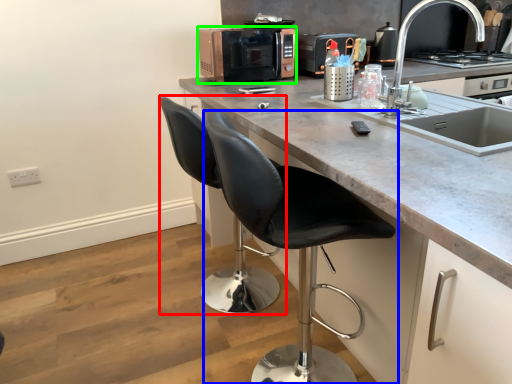
Question: Which object is positioned closest to swivel chair (highlighted by a red box)? Select from chair (highlighted by a blue box) and microwave oven (highlighted by a green box).

Choices:
 (A) chair
 (B) microwave oven

Answer: (A)